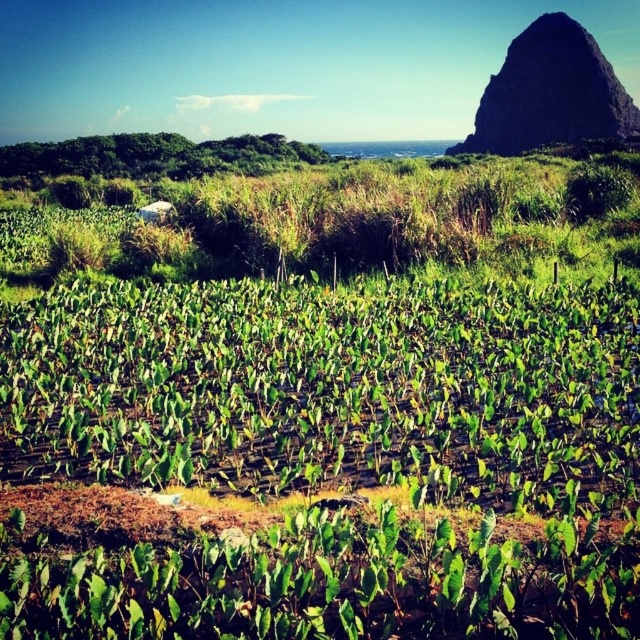
Question: Observing the image, what is the correct spatial positioning of green leafy plants at center in reference to dark brown rocky peak at upper right?

Choices:
 (A) above
 (B) below

Answer: (B)

Question: Which of the following is the closest to the observer?

Choices:
 (A) (541, 136)
 (B) (134, 433)

Answer: (B)

Question: Which point is farther to the camera?

Choices:
 (A) (637, 128)
 (B) (205, 445)

Answer: (A)

Question: Which of the following is the closest to the observer?

Choices:
 (A) dark brown rocky peak at upper right
 (B) green leafy plants at center

Answer: (B)

Question: Does green leafy plants at center have a smaller size compared to dark brown rocky peak at upper right?

Choices:
 (A) no
 (B) yes

Answer: (B)

Question: Does green leafy plants at center have a smaller size compared to dark brown rocky peak at upper right?

Choices:
 (A) yes
 (B) no

Answer: (A)